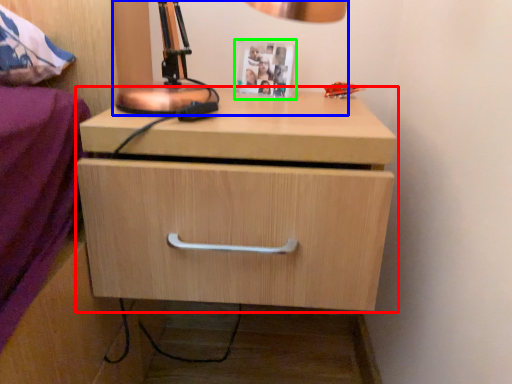
Question: Which object is the farthest from chest of drawers (highlighted by a red box)? Choose among these: table lamp (highlighted by a blue box) or picture frame (highlighted by a green box).

Choices:
 (A) table lamp
 (B) picture frame

Answer: (B)